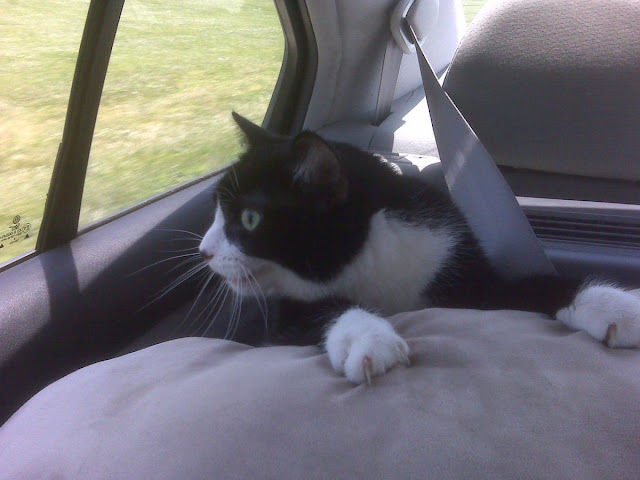
The image size is (640, 480). I want to click on pillow, so click(x=422, y=399).